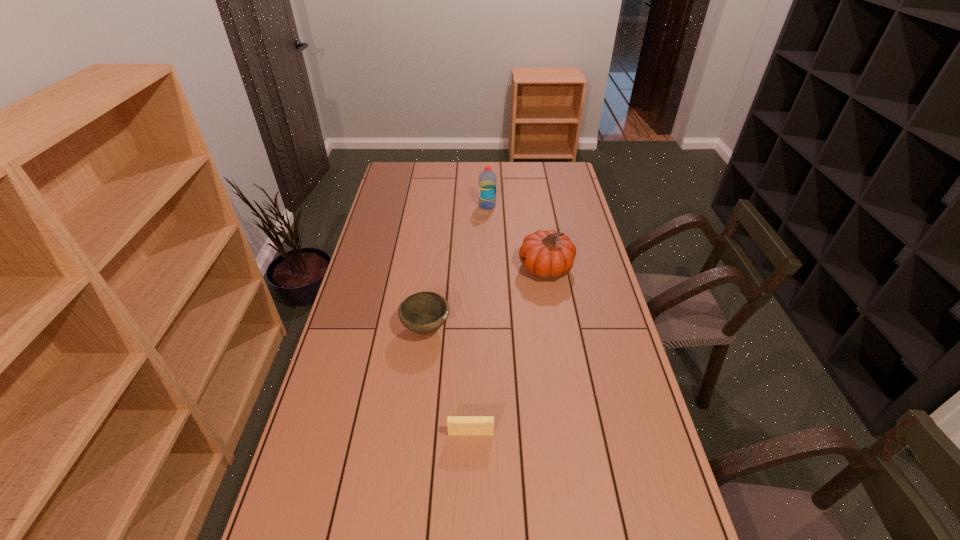
You are a GUI agent. You are given a task and a screenshot of the screen. Output one action in this format:
    pyautogui.click(x=<x>, y=<y>)
    Task: Click on the free space between the third shortest object and the nearest object
    
    Given the screenshot: What is the action you would take?
    pyautogui.click(x=508, y=350)

This screenshot has height=540, width=960. What are the coordinates of `free space that is in between the third farthest object and the shortest object` in the screenshot? It's located at (448, 381).

Find the location of a particular element. This screenshot has width=960, height=540. free area in between the videotape and the third farthest object is located at coordinates (448, 381).

What are the coordinates of `free space between the water bottle and the third shortest object` in the screenshot? It's located at (516, 237).

You are a GUI agent. You are given a task and a screenshot of the screen. Output one action in this format:
    pyautogui.click(x=<x>, y=<y>)
    Task: Click on the unoccupied position between the bowl and the second tallest object
    The image size is (960, 540).
    Given the screenshot: What is the action you would take?
    pyautogui.click(x=486, y=298)

The image size is (960, 540). In order to click on empty space that is in between the farthest object and the second tallest object in this screenshot , I will do `click(516, 237)`.

Locate an element on the screen. This screenshot has width=960, height=540. vacant space in between the second tallest object and the water bottle is located at coordinates (516, 237).

At what (x,y) coordinates should I click in order to perform the action: click on vacant space in between the water bottle and the rightmost object. Please return your answer as a coordinate pair (x, y). Looking at the image, I should click on (516, 237).

Find the location of a particular element. free area in between the farthest object and the third shortest object is located at coordinates (516, 237).

Locate an element on the screen. The width and height of the screenshot is (960, 540). free space that is in between the videotape and the pumpkin is located at coordinates coord(508,350).